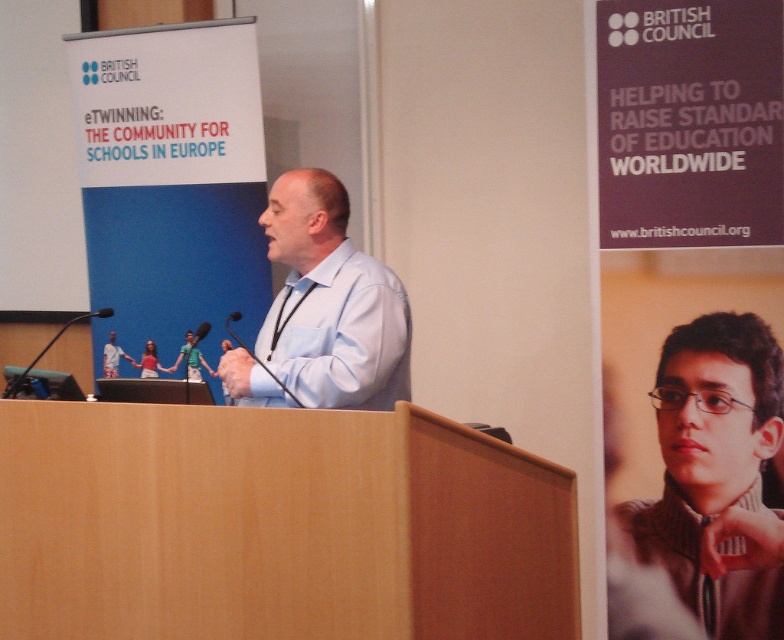
Does light blue shirt at center have a larger size compared to black matte microphone at center?

Indeed, light blue shirt at center has a larger size compared to black matte microphone at center.

Is light blue shirt at center taller than black matte microphone at center?

Yes, light blue shirt at center is taller than black matte microphone at center.

Where is `light blue shirt at center`? The height and width of the screenshot is (640, 784). light blue shirt at center is located at coordinates (329, 301).

What are the coordinates of `light blue shirt at center` in the screenshot? It's located at (329, 301).

Can you confirm if brown striped shirt at center is positioned to the left of black matte microphone at center?

No, brown striped shirt at center is not to the left of black matte microphone at center.

At what (x,y) coordinates should I click in order to perform the action: click on brown striped shirt at center. Please return your answer as a coordinate pair (x, y). Looking at the image, I should click on (717, 474).

Does point (735, 460) come farther from viewer compared to point (231, 333)?

Yes, point (735, 460) is farther from viewer.

Where is `brown striped shirt at center`? brown striped shirt at center is located at coordinates (717, 474).

Does light blue shirt at center have a greater height compared to black plastic microphone at lower left?

Correct, light blue shirt at center is much taller as black plastic microphone at lower left.

Measure the distance between point (347, 356) and camera.

2.61 meters

The image size is (784, 640). What are the coordinates of `light blue shirt at center` in the screenshot? It's located at (329, 301).